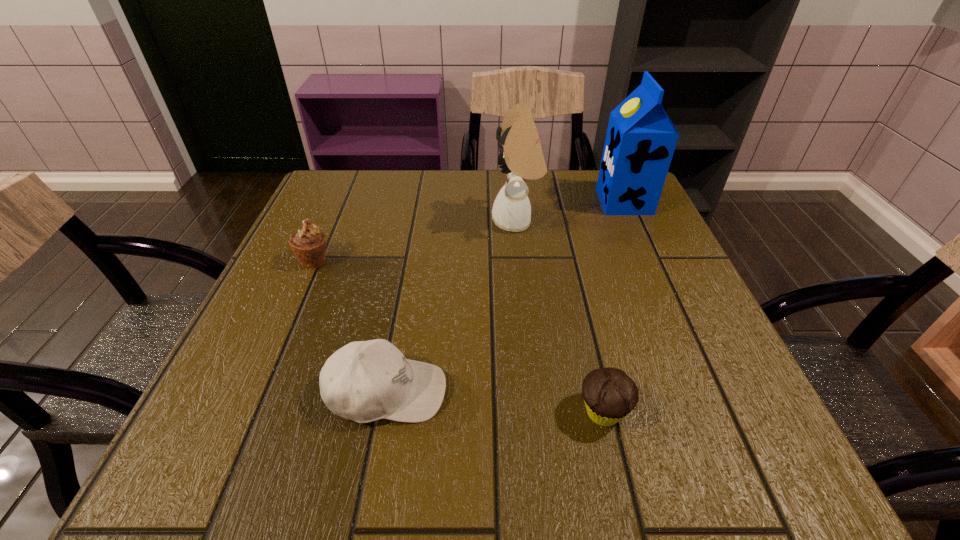
Where is `object that is the fourth closest to the rightmost object`? This screenshot has height=540, width=960. object that is the fourth closest to the rightmost object is located at coordinates (308, 244).

Image resolution: width=960 pixels, height=540 pixels. I want to click on vacant space that satisfies the following two spatial constraints: 1. at the front face of the doll; 2. on the back side of the shorter muffin, so click(x=537, y=411).

Where is `vacant space that satisfies the following two spatial constraints: 1. at the front face of the third object from left to right; 2. on the front side of the third nearest object`? Image resolution: width=960 pixels, height=540 pixels. vacant space that satisfies the following two spatial constraints: 1. at the front face of the third object from left to right; 2. on the front side of the third nearest object is located at coordinates (521, 261).

Identify the location of vacant area in the image that satisfies the following two spatial constraints: 1. with the cap open on the carton; 2. on the front side of the shortest object. (717, 411).

At what (x,y) coordinates should I click in order to perform the action: click on free space in the image that satisfies the following two spatial constraints: 1. at the front face of the fourth object from left to right; 2. on the right side of the third object from left to right. Please return your answer as a coordinate pair (x, y). This screenshot has width=960, height=540. Looking at the image, I should click on (537, 411).

In order to click on free location that satisfies the following two spatial constraints: 1. on the front-facing side of the fourth object from right to left; 2. on the left side of the second object from right to left in this screenshot , I will do `click(383, 411)`.

Locate an element on the screen. The image size is (960, 540). free spot that satisfies the following two spatial constraints: 1. at the front face of the doll; 2. on the right side of the shortest object is located at coordinates (537, 411).

Locate an element on the screen. free region that satisfies the following two spatial constraints: 1. on the back side of the shortest object; 2. at the front face of the third object from right to left is located at coordinates (560, 221).